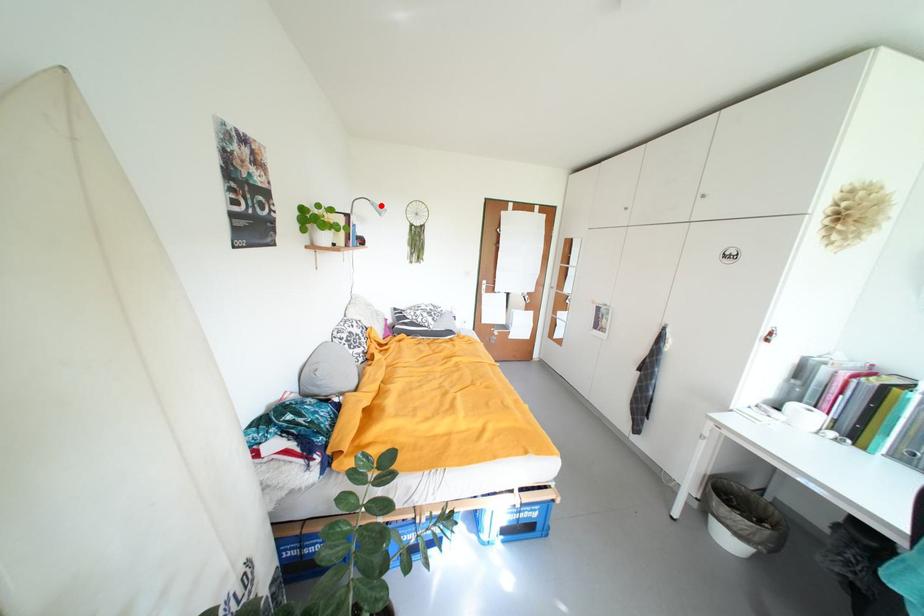
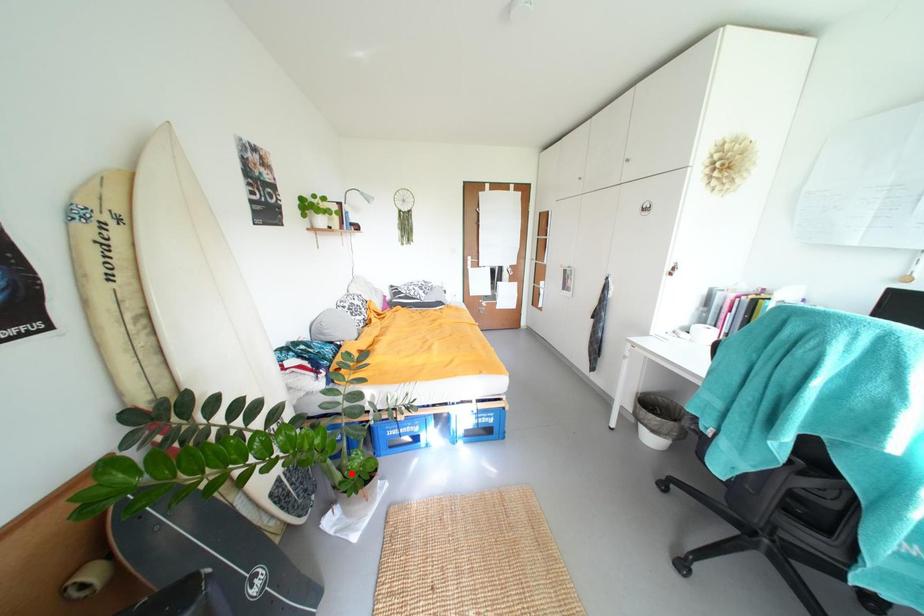
I am providing you with two images of the same scene from different viewpoints. A red point is marked on the first image and another point is marked on the second image. Do the highlighted points in image1 and image2 indicate the same real-world spot?

No